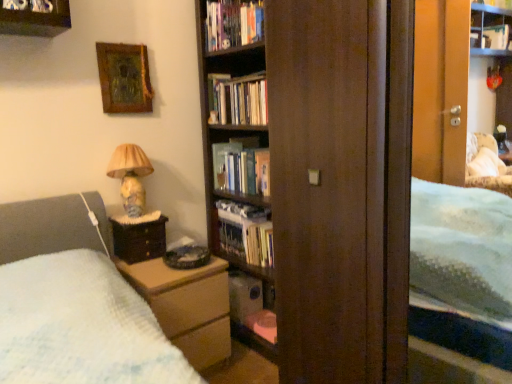
Where is `free region under matte ceramic lamp at left (from a real-world perspective)`? This screenshot has height=384, width=512. free region under matte ceramic lamp at left (from a real-world perspective) is located at coordinates (130, 216).